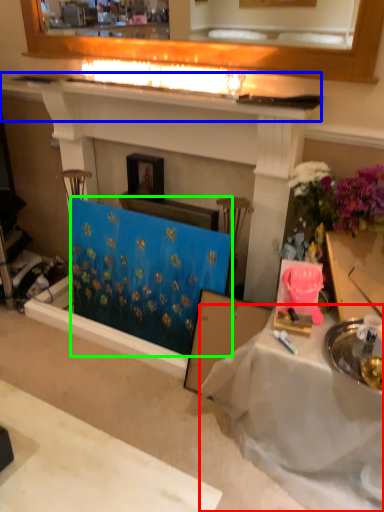
Question: Based on their relative distances, which object is farther from table (highlighted by a red box)? Choose from mantle (highlighted by a blue box) and curtain (highlighted by a green box).

Choices:
 (A) mantle
 (B) curtain

Answer: (A)